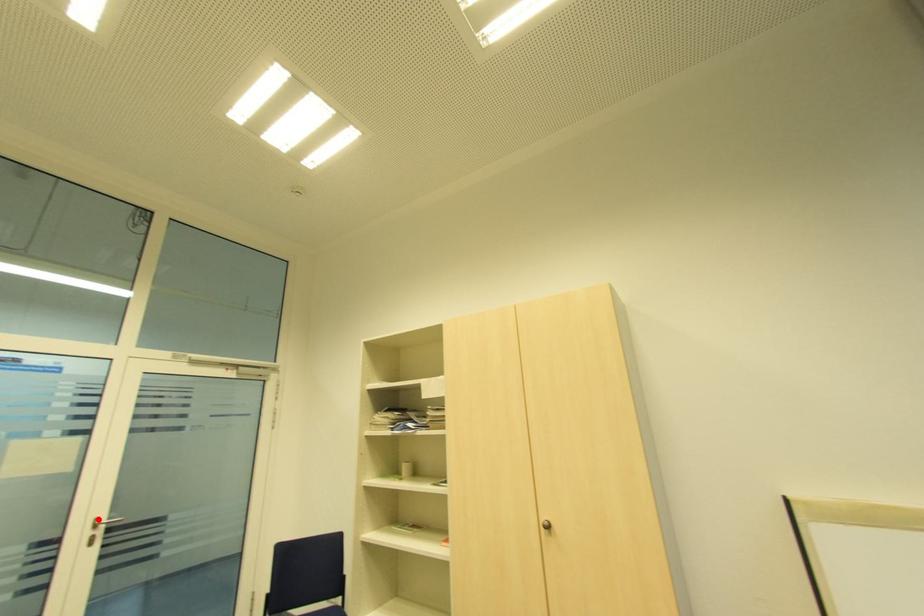
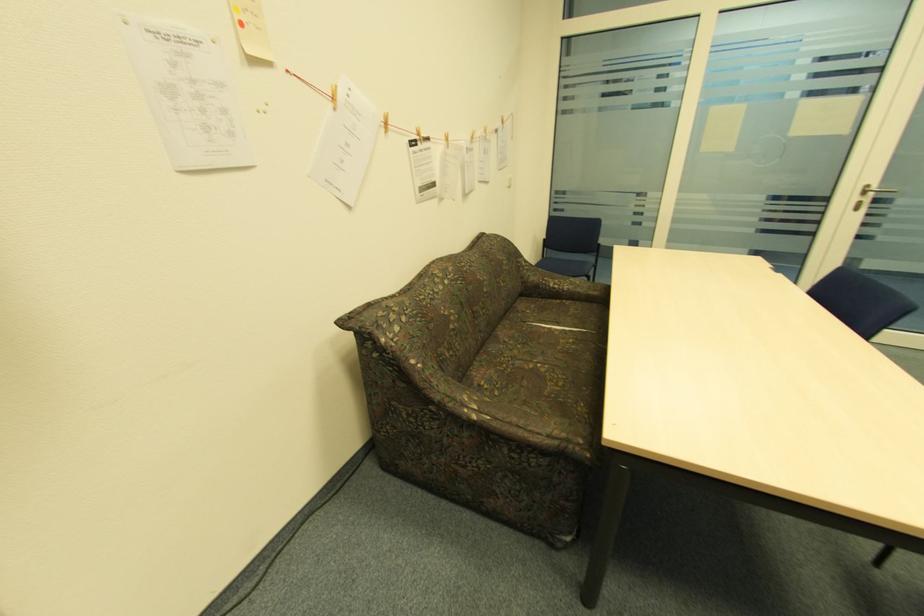
Question: I am providing you with two images of the same scene from different viewpoints. In image1, a red point is highlighted. Considering the same 3D point in image2, which of the following is correct?

Choices:
 (A) It is closer
 (B) It is farther

Answer: (B)